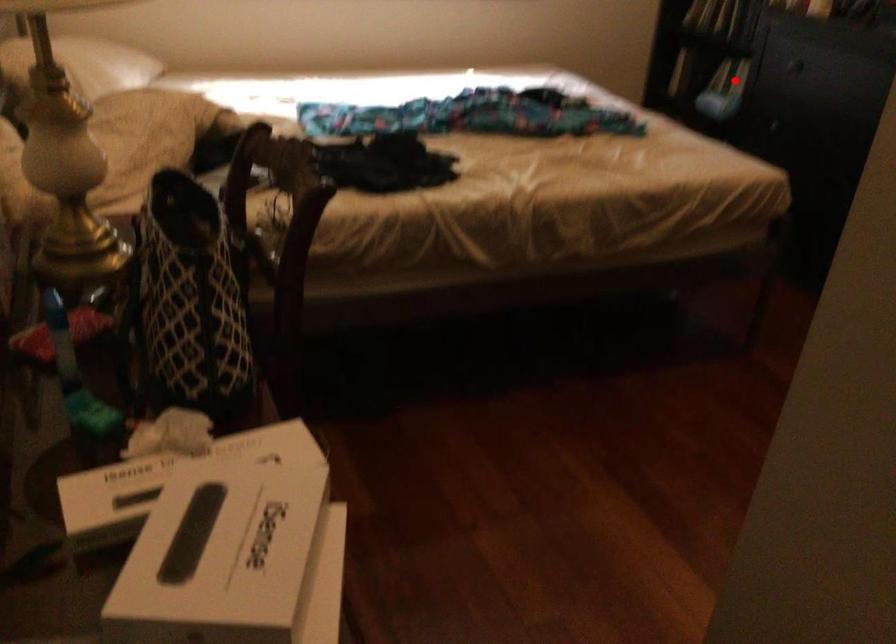
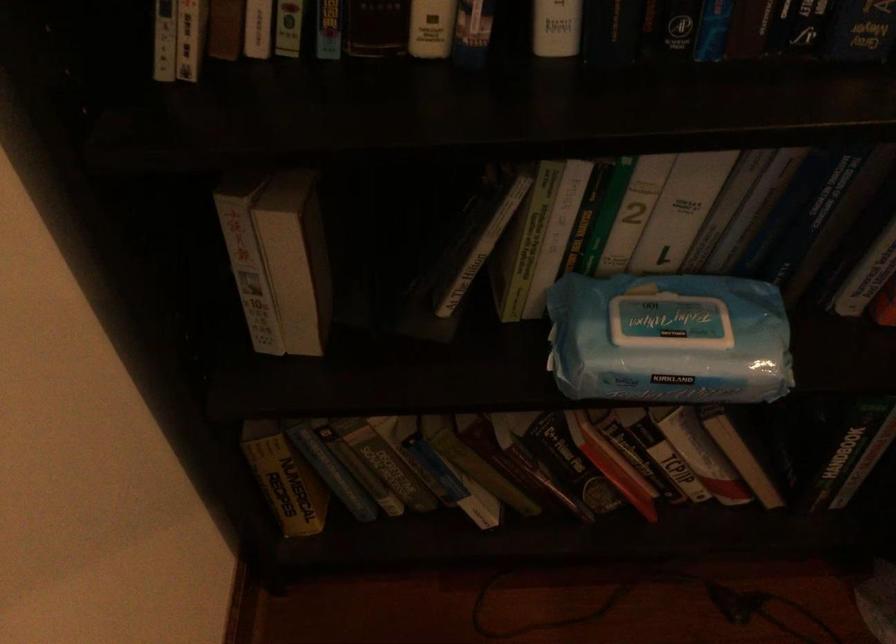
Question: I am providing you with two images of the same scene from different viewpoints. Given a red point in image1, look at the same physical point in image2. Is it:

Choices:
 (A) Closer to the viewpoint
 (B) Farther from the viewpoint

Answer: (A)